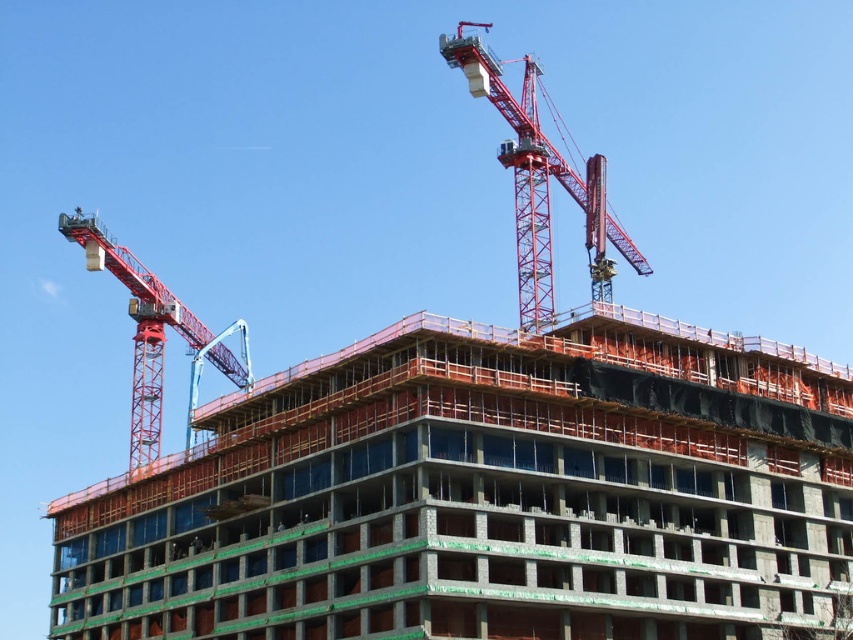
You are a construction worker standing at the base of the building. You need to position a new safety net at the exact location where the red metallic crane at upper center is currently located. According to the coordinates provided, where should you place the safety net?

The red metallic crane at upper center is located at coordinates point (x=540, y=182), so the safety net should be placed at that exact point.

Looking at this image, you are a safety inspector at the construction site. You need to ensure that the red metallic crane at upper center and the metal construction worker at upper left are visible from the ground. Which object is easier to spot from below?

The red metallic crane at upper center is easier to spot from below because it has a larger size compared to the metal construction worker at upper left.

You are a safety inspector at the construction site. You need to ensure that the metal construction worker at upper left is positioned above the concrete at center to avoid falling debris. Is the current positioning safe according to the scene?

The concrete at center is located below the metal construction worker at upper left, so the worker is positioned above the concrete. This placement helps prevent falling debris from directly hitting the concrete area below, making the current positioning safe.